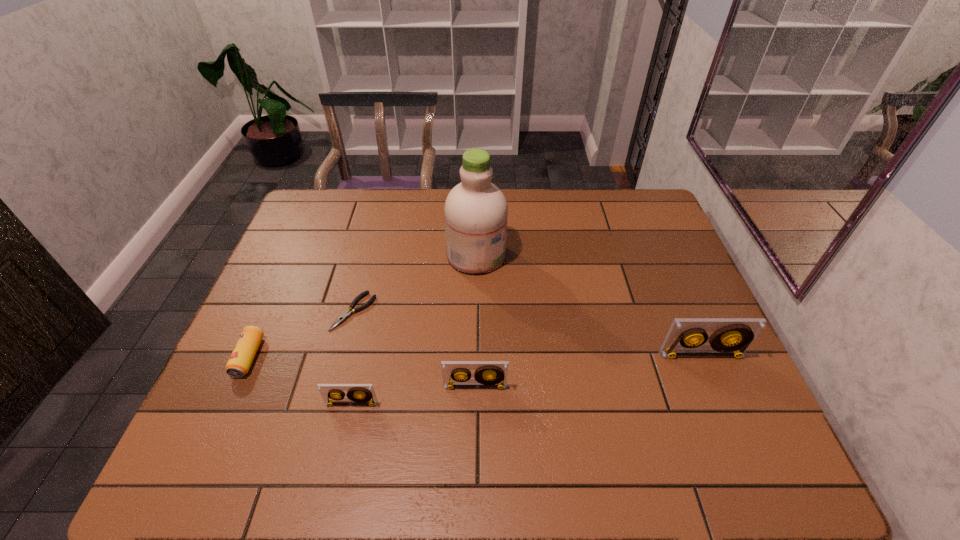
In the image, there is a desktop. In order to click on vacant space at the far edge in this screenshot , I will do `click(534, 194)`.

This screenshot has height=540, width=960. In the image, there is a desktop. Find the location of `free region at the near edge`. free region at the near edge is located at coordinates (673, 396).

Identify the location of free region at the left edge of the desktop. This screenshot has width=960, height=540. (274, 375).

At what (x,y) coordinates should I click in order to perform the action: click on free spot at the right edge of the desktop. Please return your answer as a coordinate pair (x, y). Looking at the image, I should click on (653, 303).

In the image, there is a desktop. What are the coordinates of `free space at the far left corner` in the screenshot? It's located at (332, 230).

The image size is (960, 540). I want to click on free space at the near left corner, so click(x=256, y=401).

In the image, there is a desktop. At what (x,y) coordinates should I click in order to perform the action: click on free region at the near right corner. Please return your answer as a coordinate pair (x, y). The height and width of the screenshot is (540, 960). Looking at the image, I should click on (721, 416).

I want to click on free space between the tallest object and the leftmost videotape, so click(414, 329).

The height and width of the screenshot is (540, 960). In order to click on free space between the leftmost object and the nearest object in this screenshot , I will do `click(300, 380)`.

This screenshot has width=960, height=540. I want to click on empty location between the cleansing agent and the second farthest object, so click(x=415, y=284).